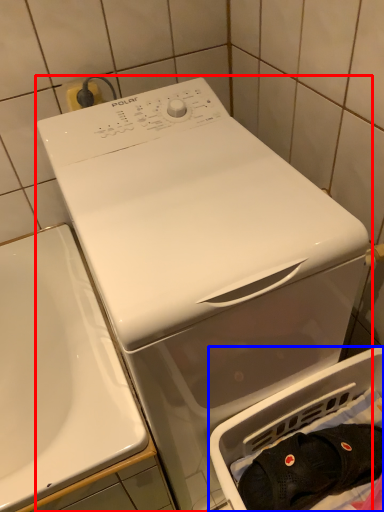
Question: Which of the following is the closest to the observer, washing machine (highlighted by a red box) or dish washer (highlighted by a blue box)?

Choices:
 (A) washing machine
 (B) dish washer

Answer: (A)